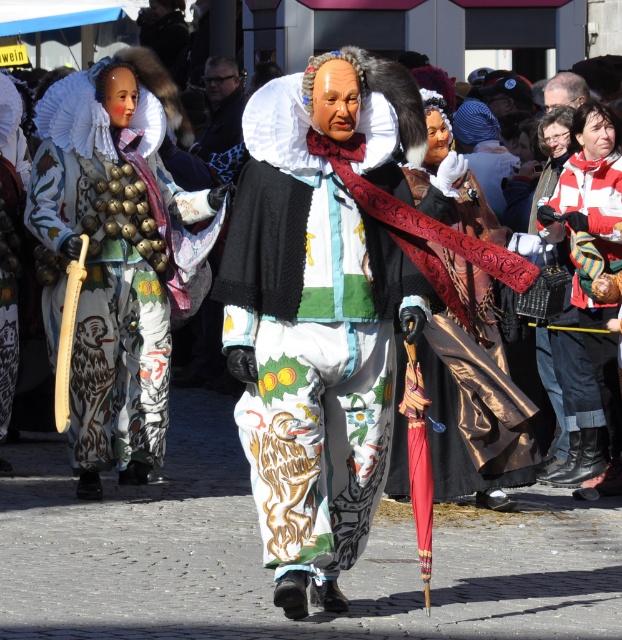
Can you confirm if matte gold bells at left is positioned above carved wood sword at center?

Yes.

At what (x,y) coordinates should I click in order to perform the action: click on matte gold bells at left. Please return your answer as a coordinate pair (x, y). Looking at the image, I should click on (118, 260).

Where is `matte gold bells at left`? The image size is (622, 640). matte gold bells at left is located at coordinates (118, 260).

The height and width of the screenshot is (640, 622). What do you see at coordinates (587, 202) in the screenshot?
I see `striped wool scarf at right` at bounding box center [587, 202].

Can you confirm if striped wool scarf at right is positioned to the right of dark gray fabric coat at center?

Correct, you'll find striped wool scarf at right to the right of dark gray fabric coat at center.

At what (x,y) coordinates should I click in order to perform the action: click on striped wool scarf at right. Please return your answer as a coordinate pair (x, y). Image resolution: width=622 pixels, height=640 pixels. Looking at the image, I should click on (587, 202).

Is point (289, 572) positioned behind point (164, 115)?

No, it is in front of (164, 115).

Is point (305, 588) farther from camera compared to point (159, 461)?

That is False.

You are a GUI agent. You are given a task and a screenshot of the screen. Output one action in this format:
    pyautogui.click(x=<x>, y=<y>)
    Task: Click on the matte white costume at center
    The image size is (622, 640).
    Given the screenshot: What is the action you would take?
    pyautogui.click(x=318, y=312)